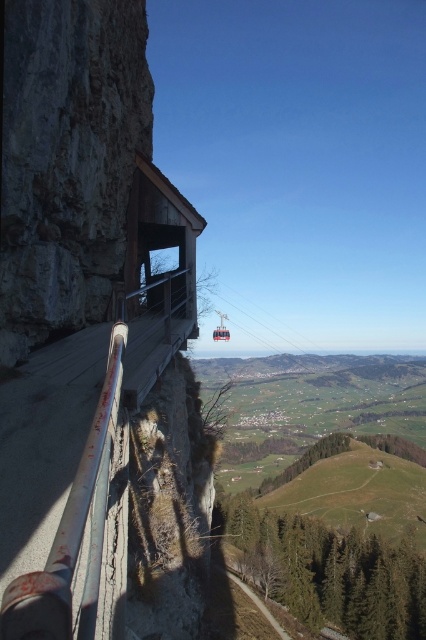
Question: Can you confirm if silver metallic rail at left is bigger than metallic cable car at center?

Choices:
 (A) yes
 (B) no

Answer: (B)

Question: Which point is farther to the camera?

Choices:
 (A) metallic cable car at center
 (B) silver metallic rail at left

Answer: (A)

Question: Among these points, which one is farthest from the camera?

Choices:
 (A) (57, 564)
 (B) (229, 336)

Answer: (B)

Question: Does silver metallic rail at left have a greater width compared to metallic cable car at center?

Choices:
 (A) no
 (B) yes

Answer: (A)

Question: Which point is closer to the camera?

Choices:
 (A) (213, 333)
 (B) (100, 433)

Answer: (B)

Question: Is silver metallic rail at left thinner than metallic cable car at center?

Choices:
 (A) no
 (B) yes

Answer: (B)